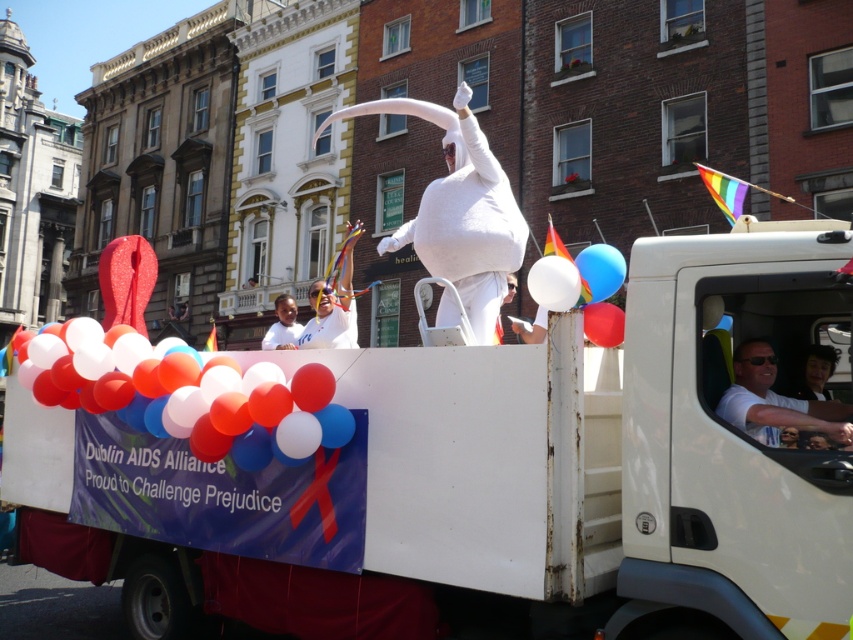
You are a photographer standing at the edge of the parade route. You want to capture a photo where both the white matte truck driver at center and the white matte balloon at upper center are clearly visible. Based on their sizes in the image, which object should you focus on first to ensure both are in frame?

The white matte truck driver at center is taller than the white matte balloon at upper center. To ensure both are in frame, focus on the taller object first, which is the white matte truck driver at center, as it requires more space in the composition.

You are a photographer at the parade and want to capture both the white matte truck driver at center and the white fluffy costume at center in the same frame. Based on their positions, which one should you focus on first to ensure both are in the shot?

The white fluffy costume at center is above the white matte truck driver at center, so you should focus on the white fluffy costume at center first to ensure both are in the shot.